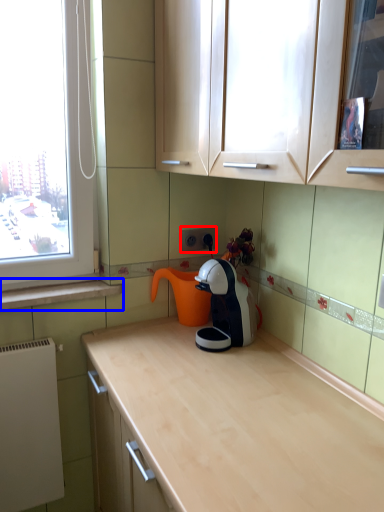
Question: Which object is closer to the camera taking this photo, electric outlet (highlighted by a red box) or window sill (highlighted by a blue box)?

Choices:
 (A) electric outlet
 (B) window sill

Answer: (B)